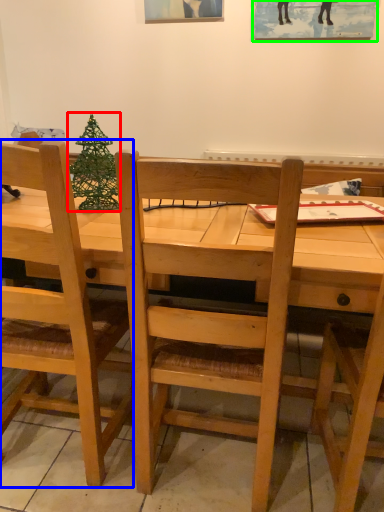
Question: Based on their relative distances, which object is farther from christmas tree (highlighted by a red box)? Choose from chair (highlighted by a blue box) and picture frame (highlighted by a green box).

Choices:
 (A) chair
 (B) picture frame

Answer: (B)